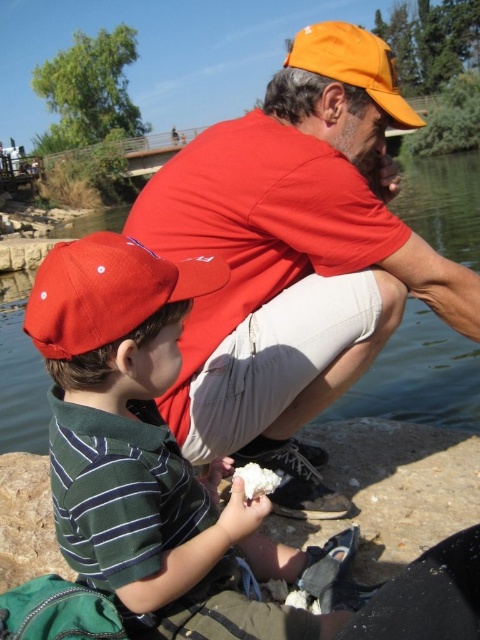
You are a photographer trying to capture a candid shot of the two people in the scene. You need to position yourself so that both the matte red baseball cap at left and the orange fabric baseball cap at upper center are visible in your frame. Given their distance apart, can you estimate if a standard camera with a 50mm lens will be able to fit both caps in the frame without moving closer?

The matte red baseball cap at left and orange fabric baseball cap at upper center are 7.42 feet apart. A standard camera with a 50mm lens typically has a field of view that can capture objects up to approximately 7 feet apart at a comfortable distance. Since 7.42 feet is slightly beyond this range, you might need to adjust your position slightly or use a wider lens to ensure both caps are fully visible in the frame.

You are a photographer trying to capture a photo of the orange cotton cap at upper center and the matte red baseball cap at left. Which of the two caps is positioned closer to the camera?

The orange cotton cap at upper center is closer to the camera because the matte red baseball cap at left is behind it.